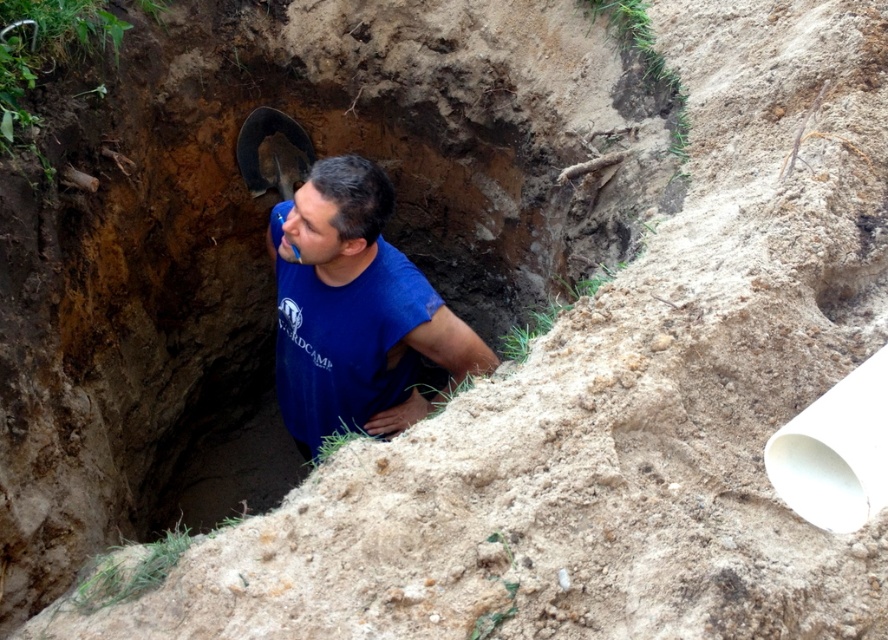
You are a construction worker who needs to place a 1.2 meter long wooden plank across the blue cotton shirt at center and the brown dirt hole at center. Given their relative heights, will the plank be able to rest stably on both objects without touching the ground?

The blue cotton shirt at center is taller than the brown dirt hole at center. Since the plank is placed across both, the difference in height might cause it to tilt, but as long as the base of the brown dirt hole provides enough support, the plank could rest stably. However, without knowing the exact height difference, it is hard to determine definitively.

You are standing at the edge of the hole and want to place a small flag at the point closest to you. Which point should you choose between point (294, 257) and point (176, 512)?

Point (294, 257) is closer to the viewer than point (176, 512), so you should choose point (294, 257) to place the flag.

You are a construction inspector. You see the blue cotton shirt at center and the brown dirt hole at center. Which object is above the other?

The blue cotton shirt at center is positioned over the brown dirt hole at center.